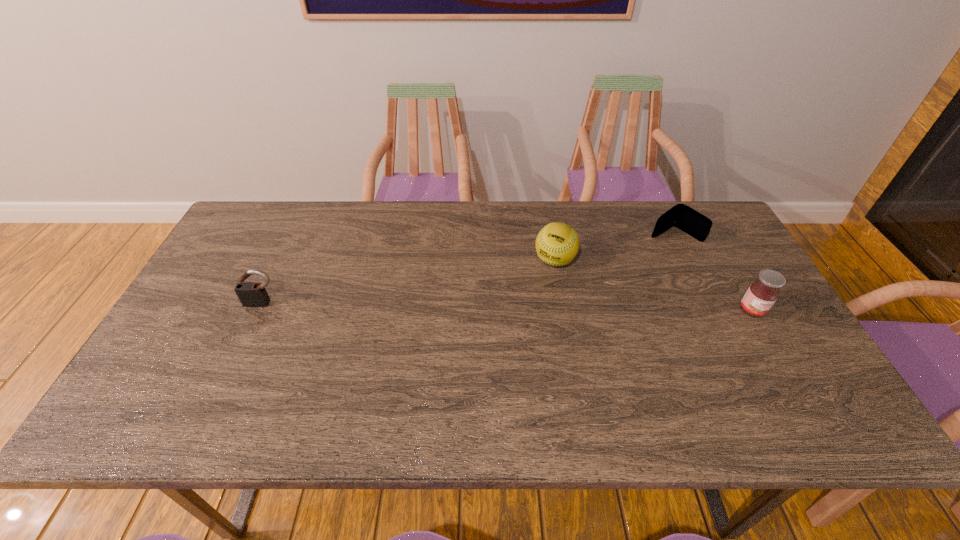
Where is `vacant space located on the logo side of the third object from right to left`? Image resolution: width=960 pixels, height=540 pixels. vacant space located on the logo side of the third object from right to left is located at coordinates (495, 361).

The image size is (960, 540). I want to click on free region located on the outer surface of the shortest object, so pos(630,258).

You are a GUI agent. You are given a task and a screenshot of the screen. Output one action in this format:
    pyautogui.click(x=<x>, y=<y>)
    Task: Click on the vacant space located 0.400m on the outer surface of the shortest object
    The image size is (960, 540).
    Given the screenshot: What is the action you would take?
    pyautogui.click(x=566, y=299)

At what (x,y) coordinates should I click in order to perform the action: click on free space located 0.240m on the outer surface of the shortest object. Please return your answer as a coordinate pair (x, y). This screenshot has height=540, width=960. Looking at the image, I should click on (605, 274).

You are a GUI agent. You are given a task and a screenshot of the screen. Output one action in this format:
    pyautogui.click(x=<x>, y=<y>)
    Task: Click on the softball present at the far edge
    
    Given the screenshot: What is the action you would take?
    pyautogui.click(x=557, y=244)

Locate an element on the screen. wallet present at the far edge is located at coordinates (681, 216).

I want to click on object present at the left edge, so click(251, 294).

I want to click on jam located in the right edge section of the desktop, so click(x=761, y=295).

What are the coordinates of `wallet at the right edge` in the screenshot? It's located at (681, 216).

Locate an element on the screen. This screenshot has height=540, width=960. object positioned at the far right corner is located at coordinates (681, 216).